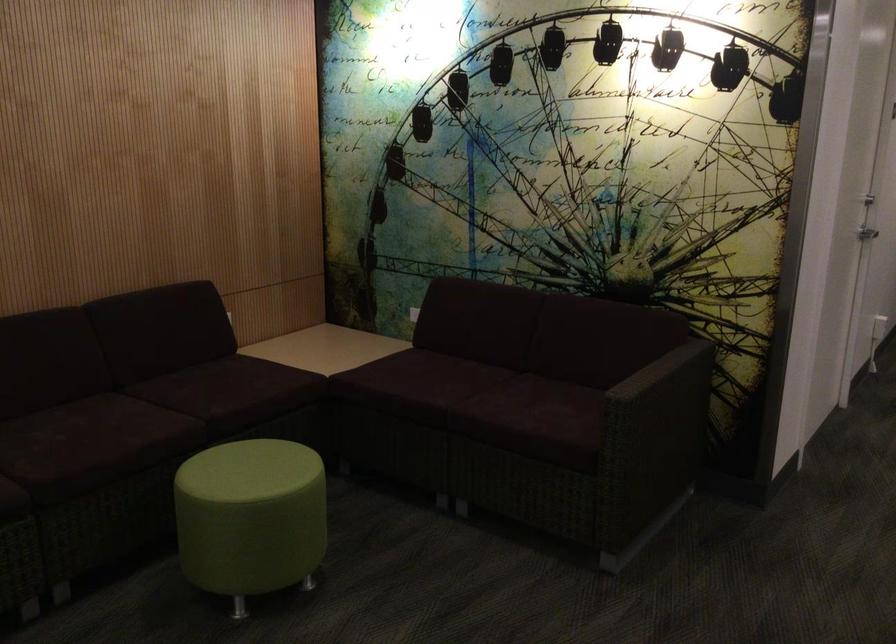
Image resolution: width=896 pixels, height=644 pixels. I want to click on sofa armrest, so click(x=667, y=370).